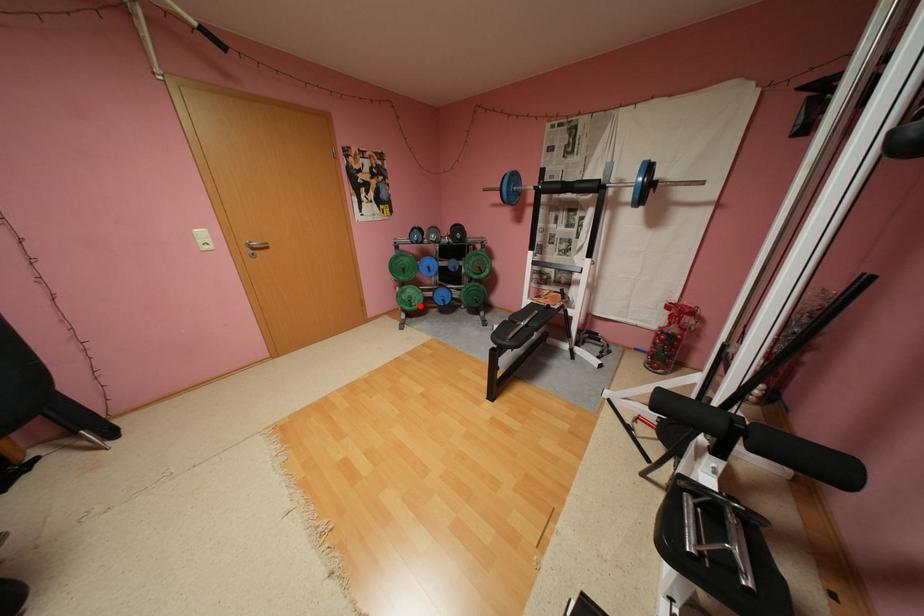
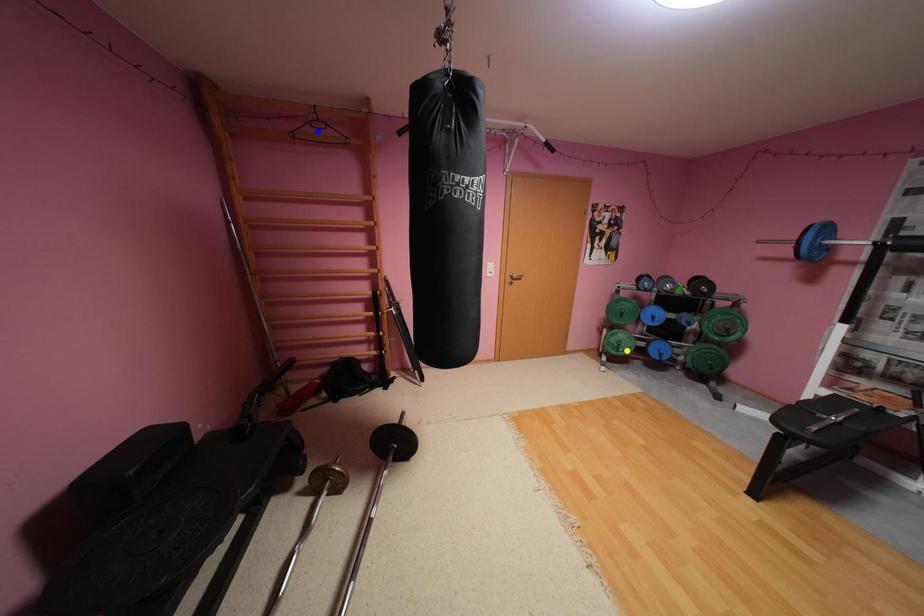
Question: I am providing you with two images of the same scene from different viewpoints. A red point is marked on the first image. You are given multiple points on the second image. Which mark in image 2 goes with the point in image 1?

Choices:
 (A) blue point
 (B) yellow point
 (C) green point

Answer: (B)